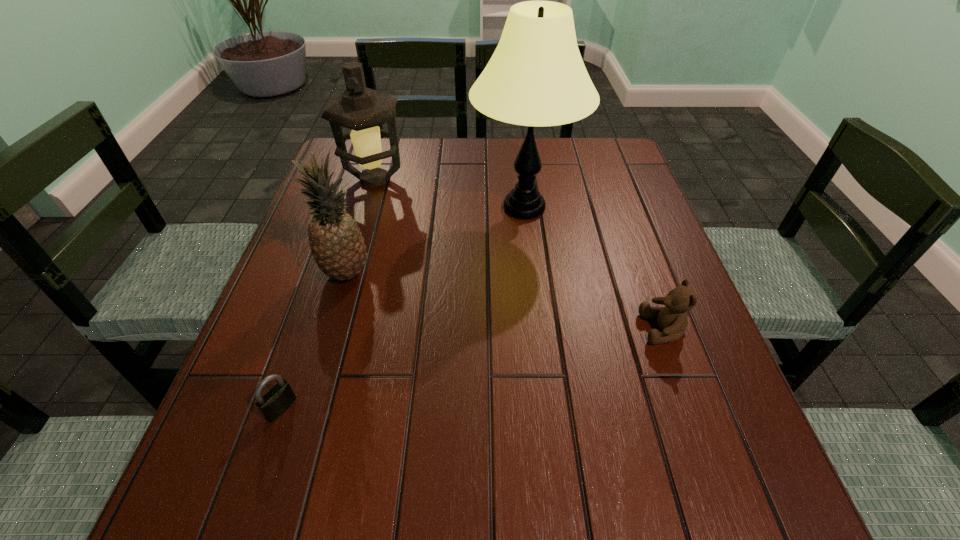
This screenshot has width=960, height=540. Identify the location of object that is positioned at the right edge. (672, 319).

In order to click on object that is positioned at the far left corner in this screenshot , I will do `click(361, 109)`.

The image size is (960, 540). What are the coordinates of `blank space at the far edge` in the screenshot? It's located at (412, 153).

Locate an element on the screen. The image size is (960, 540). vacant space at the near edge of the desktop is located at coordinates 510,488.

In order to click on vacant space at the left edge in this screenshot , I will do `click(249, 462)`.

In the image, there is a desktop. Where is `blank space at the right edge`? blank space at the right edge is located at coordinates (605, 231).

Where is `vacant area at the far right corner`? The height and width of the screenshot is (540, 960). vacant area at the far right corner is located at coordinates (569, 150).

Locate an element on the screen. The image size is (960, 540). free point between the padlock and the tallest object is located at coordinates (402, 308).

Identify the location of free spot between the fourth farthest object and the padlock. Image resolution: width=960 pixels, height=540 pixels. (472, 368).

I want to click on empty location between the shortest object and the rightmost object, so click(x=472, y=368).